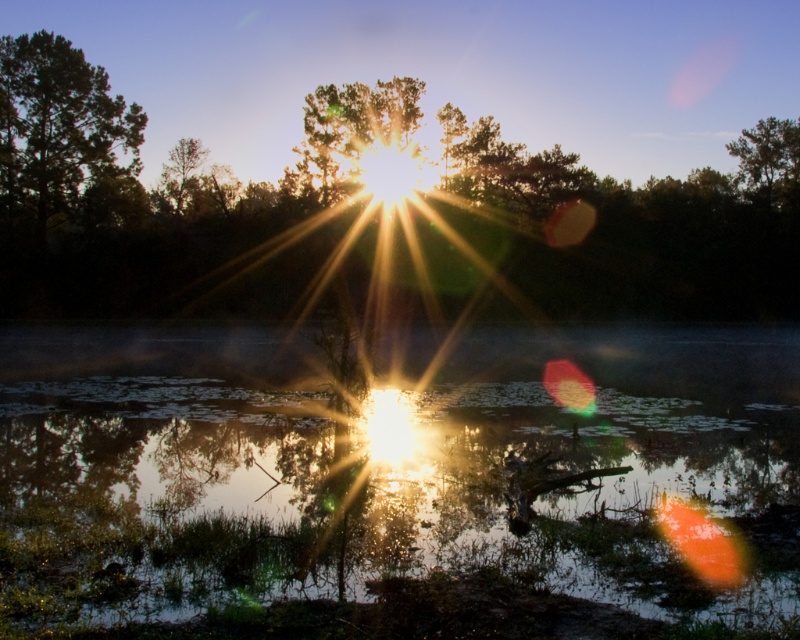
Question: Is transparent water at center thinner than silvery metallic tree at center?

Choices:
 (A) yes
 (B) no

Answer: (A)

Question: Does transparent water at center have a smaller size compared to green matte tree at upper right?

Choices:
 (A) yes
 (B) no

Answer: (A)

Question: Which of the following is the closest to the observer?

Choices:
 (A) (130, 161)
 (B) (184, 342)
 (C) (798, 200)
 (D) (28, 120)

Answer: (B)

Question: Is silvery metallic tree at center further to camera compared to green matte tree at upper left?

Choices:
 (A) yes
 (B) no

Answer: (A)

Question: Which point appears closest to the camera in this image?

Choices:
 (A) (5, 68)
 (B) (112, 492)

Answer: (B)

Question: Among these objects, which one is farthest from the camera?

Choices:
 (A) silvery metallic tree at center
 (B) green matte tree at upper right
 (C) transparent water at center
 (D) green matte tree at upper left

Answer: (B)